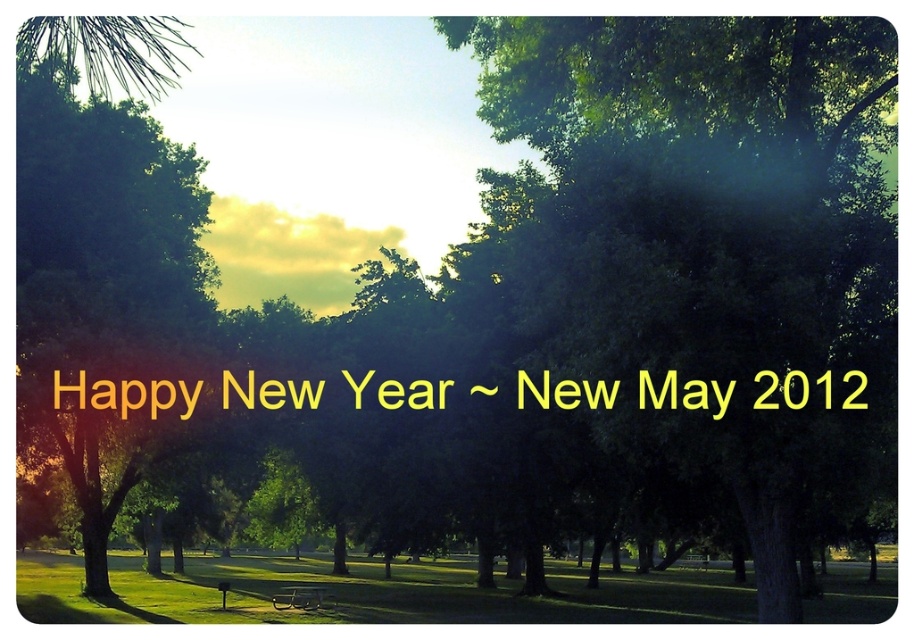
Question: Can you confirm if yellow metallic text at center is positioned above wooden park bench at lower center?

Choices:
 (A) yes
 (B) no

Answer: (A)

Question: Can you confirm if yellow metallic text at center is positioned below wooden park bench at lower center?

Choices:
 (A) no
 (B) yes

Answer: (A)

Question: Considering the relative positions of yellow metallic text at center and wooden park bench at lower center in the image provided, where is yellow metallic text at center located with respect to wooden park bench at lower center?

Choices:
 (A) right
 (B) left

Answer: (A)

Question: Among these points, which one is farthest from the camera?

Choices:
 (A) (538, 388)
 (B) (291, 596)

Answer: (B)

Question: Which of the following is the farthest from the observer?

Choices:
 (A) yellow metallic text at center
 (B) wooden park bench at lower center

Answer: (B)